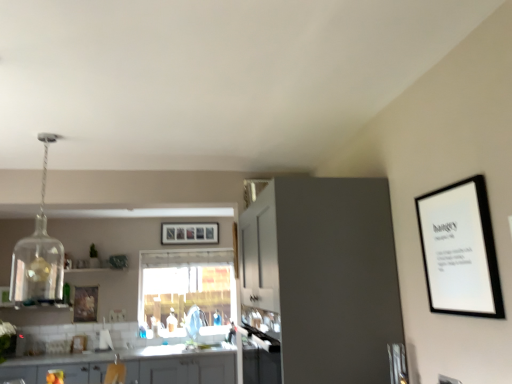
Question: Does white matte picture frame at upper right, arranged as the 1th picture frame when viewed from the front, have a larger size compared to wooden picture frame at left, marked as the third picture frame in a top-to-bottom arrangement?

Choices:
 (A) no
 (B) yes

Answer: (B)

Question: From the image's perspective, is white matte picture frame at upper right, the third picture frame viewed from the left, located above wooden picture frame at left, which appears as the second picture frame when viewed from the back?

Choices:
 (A) no
 (B) yes

Answer: (B)

Question: Is white matte picture frame at upper right, placed as the third picture frame when sorted from back to front, positioned before wooden picture frame at left, the first picture frame in the left-to-right sequence?

Choices:
 (A) no
 (B) yes

Answer: (B)

Question: Is white matte picture frame at upper right, arranged as the 1th picture frame when viewed from the front, placed right next to wooden picture frame at left, the 3th picture frame in the right-to-left sequence?

Choices:
 (A) no
 (B) yes

Answer: (A)

Question: Is white matte picture frame at upper right, the third picture frame in the bottom-to-top sequence, wider than wooden picture frame at left, marked as the third picture frame in a top-to-bottom arrangement?

Choices:
 (A) no
 (B) yes

Answer: (B)

Question: From the image's perspective, would you say white matte picture frame at upper right, marked as the 1th picture frame in a top-to-bottom arrangement, is shown under wooden picture frame at left, marked as the third picture frame in a top-to-bottom arrangement?

Choices:
 (A) no
 (B) yes

Answer: (A)

Question: Can you confirm if matte gray cabinet at center, placed as the second cabinetry when sorted from bottom to top, is taller than transparent glass window at center?

Choices:
 (A) yes
 (B) no

Answer: (A)

Question: Is matte gray cabinet at center, which is counted as the 2th cabinetry, starting from the left, positioned far away from transparent glass window at center?

Choices:
 (A) no
 (B) yes

Answer: (B)

Question: From a real-world perspective, is matte gray cabinet at center, which is the first cabinetry in right-to-left order, positioned over transparent glass window at center based on gravity?

Choices:
 (A) no
 (B) yes

Answer: (A)

Question: Is matte gray cabinet at center, which is counted as the 2th cabinetry, starting from the left, oriented away from transparent glass window at center?

Choices:
 (A) yes
 (B) no

Answer: (B)

Question: Considering the relative sizes of matte gray cabinet at center, placed as the 1th cabinetry when sorted from front to back, and transparent glass window at center in the image provided, is matte gray cabinet at center, placed as the 1th cabinetry when sorted from front to back, wider than transparent glass window at center?

Choices:
 (A) yes
 (B) no

Answer: (A)

Question: Is matte gray cabinet at center, placed as the second cabinetry when sorted from bottom to top, surrounding transparent glass window at center?

Choices:
 (A) no
 (B) yes

Answer: (A)

Question: Is transparent glass window at center surrounded by matte gray cabinets at lower left, marked as the 1th cabinetry in a bottom-to-top arrangement?

Choices:
 (A) no
 (B) yes

Answer: (A)